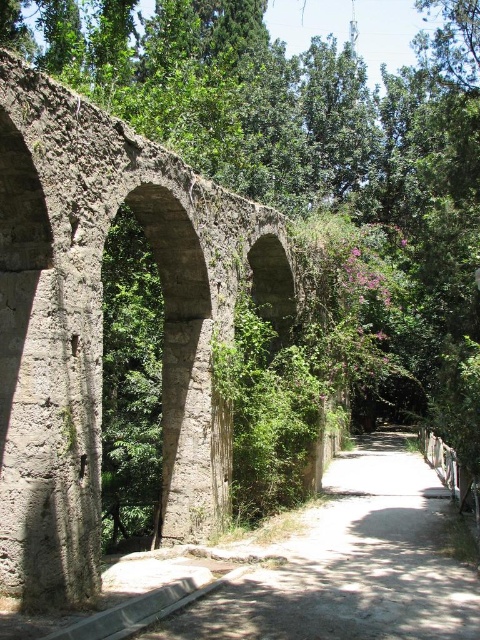
Is rusty concrete arch bridge at center further to camera compared to dirt path at center?

Yes, rusty concrete arch bridge at center is further from the viewer.

The height and width of the screenshot is (640, 480). Find the location of `rusty concrete arch bridge at center`. rusty concrete arch bridge at center is located at coordinates (100, 326).

The width and height of the screenshot is (480, 640). Describe the element at coordinates (100, 326) in the screenshot. I see `rusty concrete arch bridge at center` at that location.

Locate an element on the screen. The height and width of the screenshot is (640, 480). rusty concrete arch bridge at center is located at coordinates (x=100, y=326).